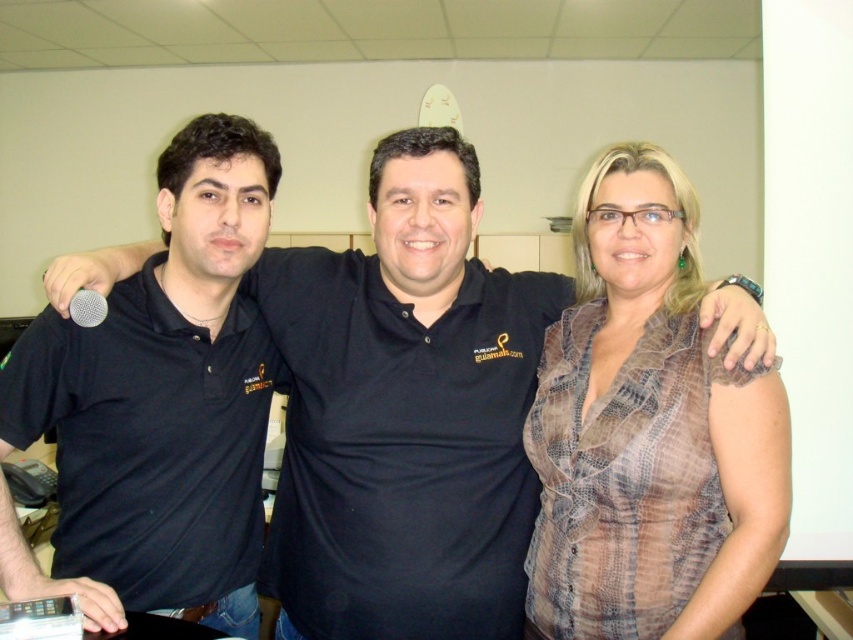
Is black matte shirt at center to the right of silver metallic microphone at left from the viewer's perspective?

Correct, you'll find black matte shirt at center to the right of silver metallic microphone at left.

Which is in front, point (508, 580) or point (79, 291)?

Positioned in front is point (79, 291).

Who is more distant from viewer, (x=480, y=604) or (x=74, y=310)?

The point (x=480, y=604) is more distant.

Where is `black matte shirt at center`? black matte shirt at center is located at coordinates (405, 412).

Does plaid fabric blouse at center have a lesser width compared to silver metallic microphone at lower left?

Incorrect, plaid fabric blouse at center's width is not less than silver metallic microphone at lower left's.

Is point (532, 413) farther from camera compared to point (68, 304)?

Yes, point (532, 413) is farther from viewer.

At what (x,y) coordinates should I click in order to perform the action: click on plaid fabric blouse at center. Please return your answer as a coordinate pair (x, y). Looking at the image, I should click on (648, 433).

Does black matte shirt at center have a smaller size compared to silver metallic microphone at lower left?

Incorrect, black matte shirt at center is not smaller in size than silver metallic microphone at lower left.

Which is in front, point (262, 275) or point (96, 292)?

Point (96, 292)

You are a GUI agent. You are given a task and a screenshot of the screen. Output one action in this format:
    pyautogui.click(x=<x>, y=<y>)
    Task: Click on the black matte shirt at center
    
    Given the screenshot: What is the action you would take?
    pyautogui.click(x=405, y=412)